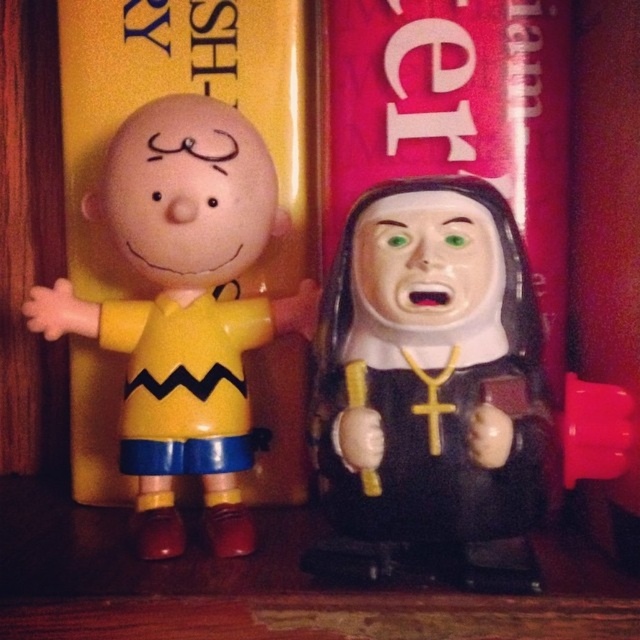
Question: Is black matte nun at center wider than yellow matte plastic charlie brown figure at left?

Choices:
 (A) yes
 (B) no

Answer: (B)

Question: Does black matte nun at center have a greater width compared to yellow matte plastic charlie brown figure at left?

Choices:
 (A) no
 (B) yes

Answer: (A)

Question: Is black matte nun at center smaller than yellow matte plastic charlie brown figure at left?

Choices:
 (A) yes
 (B) no

Answer: (A)

Question: Which point is farther to the camera?

Choices:
 (A) (452, 368)
 (B) (234, 317)

Answer: (B)